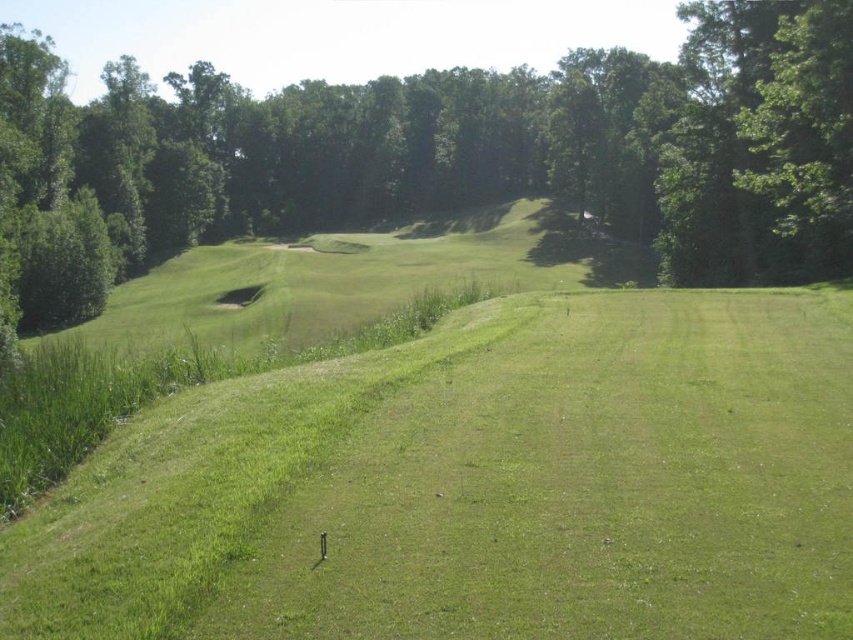
Who is higher up, green grassy field at center or green leafy tree at center?

green leafy tree at center

You are a GUI agent. You are given a task and a screenshot of the screen. Output one action in this format:
    pyautogui.click(x=<x>, y=<y>)
    Task: Click on the green grassy field at center
    The width and height of the screenshot is (853, 640).
    Given the screenshot: What is the action you would take?
    pyautogui.click(x=479, y=486)

Identify the location of green grassy field at center. The height and width of the screenshot is (640, 853). (479, 486).